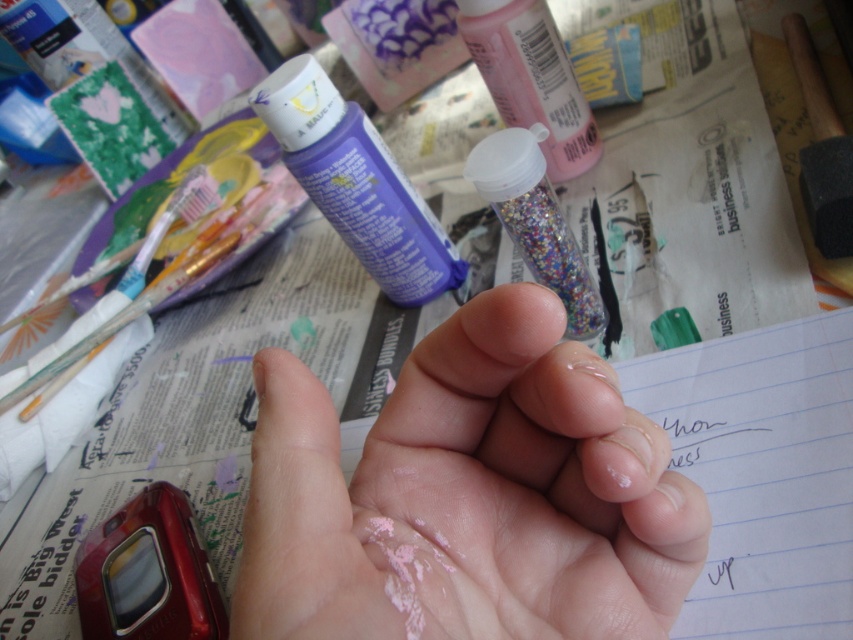
Question: Considering the relative positions of pink matte paint at center and shiny plastic glitter container at center in the image provided, where is pink matte paint at center located with respect to shiny plastic glitter container at center?

Choices:
 (A) below
 (B) above

Answer: (A)

Question: Which is nearer to the shiny plastic glitter container at center?

Choices:
 (A) pink matte paint at center
 (B) purple matte tube at upper center

Answer: (B)

Question: Considering the real-world distances, which object is closest to the purple matte tube at upper center?

Choices:
 (A) pink matte paint at center
 (B) shiny plastic glitter container at center

Answer: (B)

Question: Is pink matte paint at center to the right of shiny plastic glitter container at center from the viewer's perspective?

Choices:
 (A) no
 (B) yes

Answer: (A)

Question: Estimate the real-world distances between objects in this image. Which object is closer to the pink matte paint at center?

Choices:
 (A) shiny plastic glitter container at center
 (B) purple matte tube at upper center

Answer: (A)

Question: Does purple matte tube at upper center appear on the left side of shiny plastic glitter container at center?

Choices:
 (A) no
 (B) yes

Answer: (B)